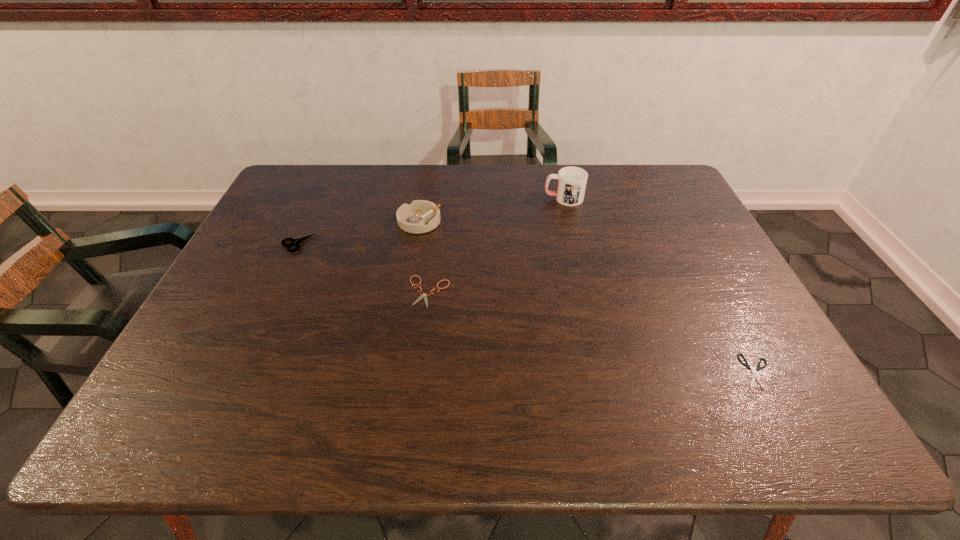
This screenshot has height=540, width=960. I want to click on blank area in the image that satisfies the following two spatial constraints: 1. on the front side of the leftmost shears; 2. on the left side of the second tallest shears, so click(276, 292).

In order to click on free space that satisfies the following two spatial constraints: 1. on the front side of the nearest shears; 2. on the left side of the leftmost object in this screenshot , I will do click(x=240, y=372).